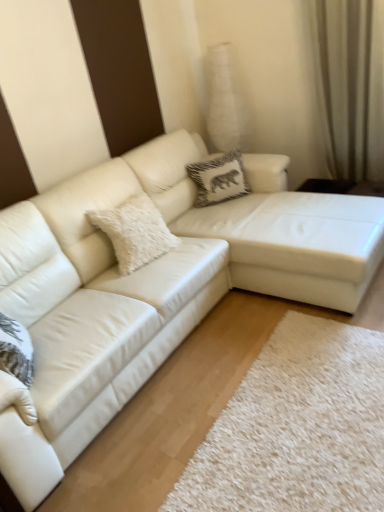
Question: Which direction should I rotate to look at white fluffy pillow at center, which is the 1th pillow from front to back, — up or down?

Choices:
 (A) up
 (B) down

Answer: (A)

Question: Considering the relative sizes of white fluffy pillow at center, placed as the first pillow when sorted from left to right, and white leather couch at center in the image provided, is white fluffy pillow at center, placed as the first pillow when sorted from left to right, thinner than white leather couch at center?

Choices:
 (A) no
 (B) yes

Answer: (B)

Question: Is the position of white fluffy pillow at center, which appears as the 2th pillow when viewed from the right, more distant than that of white leather couch at center?

Choices:
 (A) no
 (B) yes

Answer: (B)

Question: Is white fluffy pillow at center, which is the 1th pillow from front to back, at the left side of white leather couch at center?

Choices:
 (A) no
 (B) yes

Answer: (B)

Question: Is white leather couch at center surrounded by white fluffy pillow at center, placed as the first pillow when sorted from left to right?

Choices:
 (A) no
 (B) yes

Answer: (A)

Question: Considering the relative sizes of white fluffy pillow at center, which is counted as the 2th pillow, starting from the top, and white leather couch at center in the image provided, is white fluffy pillow at center, which is counted as the 2th pillow, starting from the top, smaller than white leather couch at center?

Choices:
 (A) no
 (B) yes

Answer: (B)

Question: Does white fluffy pillow at center, which is the 1th pillow from front to back, have a greater height compared to white leather couch at center?

Choices:
 (A) no
 (B) yes

Answer: (A)

Question: Can white leather couch at center be found inside beige fabric curtain at upper right?

Choices:
 (A) yes
 (B) no

Answer: (B)

Question: Does beige fabric curtain at upper right turn towards white leather couch at center?

Choices:
 (A) no
 (B) yes

Answer: (B)

Question: Can you confirm if beige fabric curtain at upper right is positioned to the left of white leather couch at center?

Choices:
 (A) no
 (B) yes

Answer: (A)

Question: Considering the relative sizes of beige fabric curtain at upper right and white leather couch at center in the image provided, is beige fabric curtain at upper right taller than white leather couch at center?

Choices:
 (A) yes
 (B) no

Answer: (A)

Question: Is beige fabric curtain at upper right shorter than white leather couch at center?

Choices:
 (A) no
 (B) yes

Answer: (A)

Question: From a real-world perspective, is beige fabric curtain at upper right located beneath white leather couch at center?

Choices:
 (A) no
 (B) yes

Answer: (A)

Question: From a real-world perspective, is beige fabric curtain at upper right over white fluffy pillow at center, which is counted as the 2th pillow, starting from the top?

Choices:
 (A) yes
 (B) no

Answer: (A)